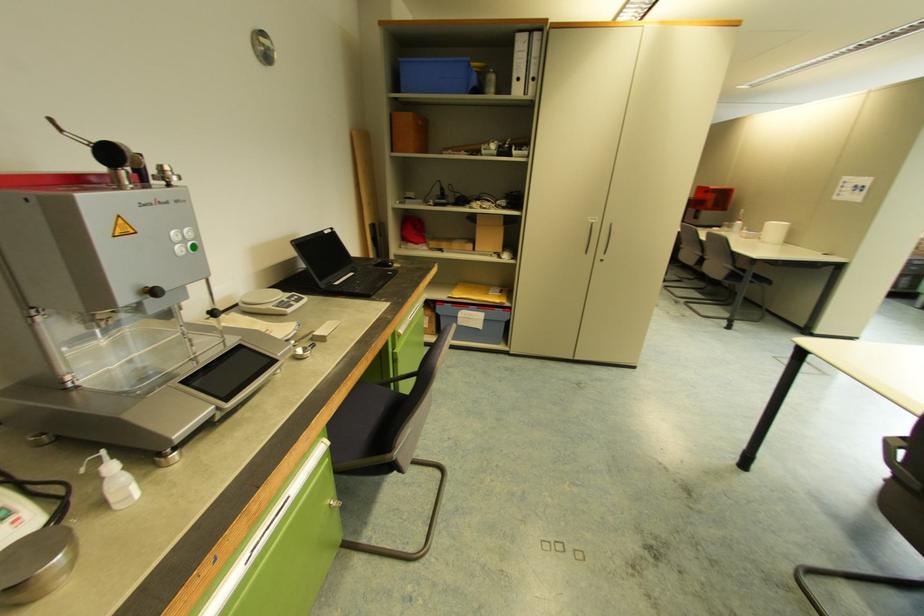
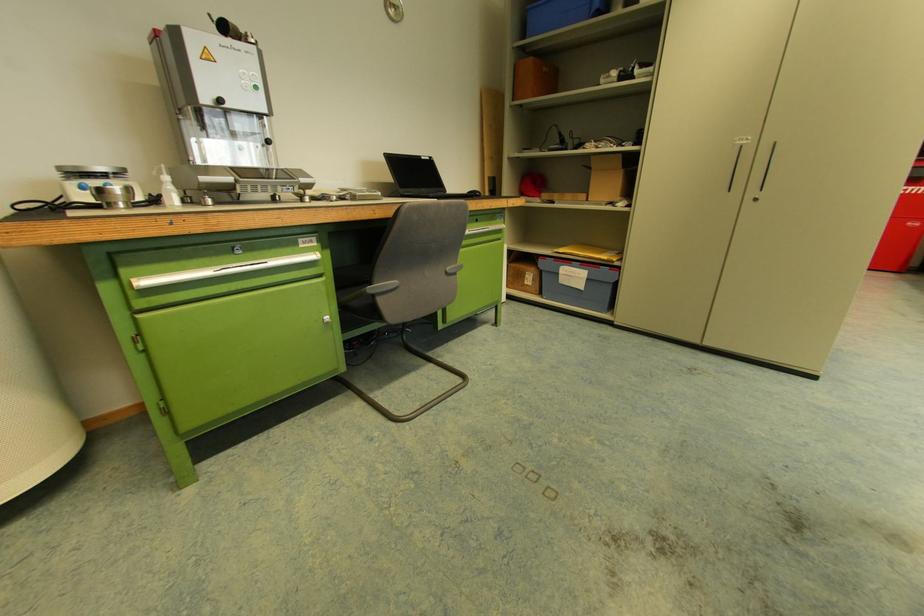
In the second image, find the point that corresponds to (x=432, y=317) in the first image.

(536, 275)